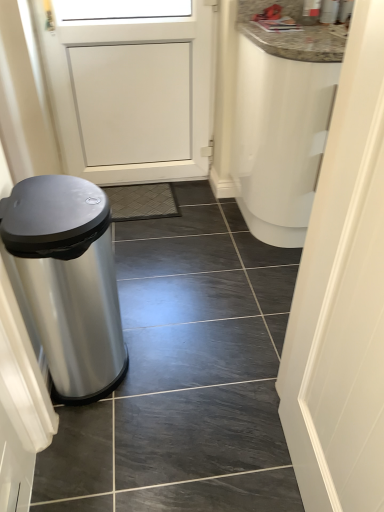
The width and height of the screenshot is (384, 512). Find the location of `vacant space to the right of polished stainless steel trash can at left`. vacant space to the right of polished stainless steel trash can at left is located at coordinates (172, 359).